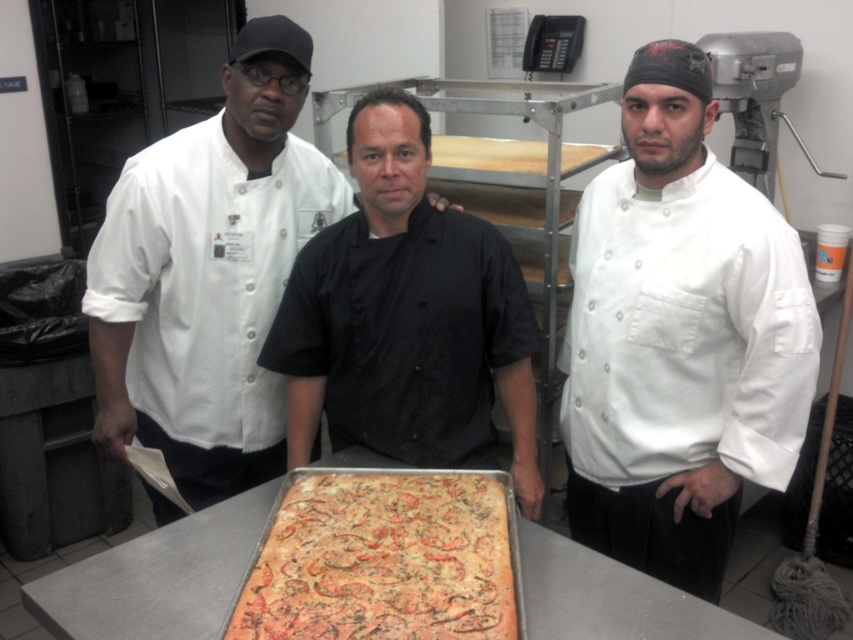
Question: Which point is closer to the camera?

Choices:
 (A) (711, 74)
 (B) (354, 528)

Answer: (B)

Question: Is white matte chef coat at center thinner than white matte chef coat at left?

Choices:
 (A) yes
 (B) no

Answer: (A)

Question: Is black matte chef coat at center bigger than golden-brown crusty pizza at center?

Choices:
 (A) no
 (B) yes

Answer: (B)

Question: Does white matte chef coat at center appear under black matte chef coat at center?

Choices:
 (A) no
 (B) yes

Answer: (B)

Question: Which of these objects is positioned closest to the white matte chef coat at center?

Choices:
 (A) black matte chef coat at center
 (B) golden-brown crusty pizza at center

Answer: (A)

Question: Which of these objects is positioned closest to the black matte chef coat at center?

Choices:
 (A) white matte chef coat at left
 (B) golden-brown crusty pizza at center

Answer: (A)